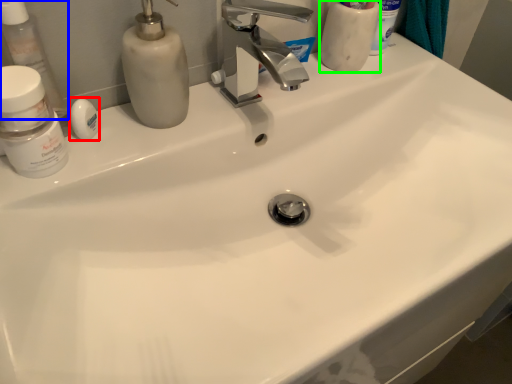
Question: Which is nearer to the soap (highlighted by a red box)? toiletry (highlighted by a blue box) or toiletry (highlighted by a green box).

Choices:
 (A) toiletry
 (B) toiletry

Answer: (A)